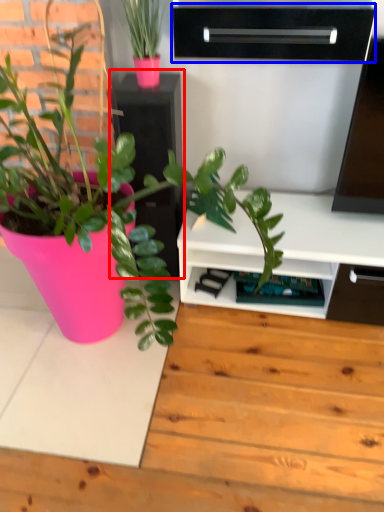
Question: Which point is further to the camera, file cabinet (highlighted by a red box) or shelf (highlighted by a blue box)?

Choices:
 (A) file cabinet
 (B) shelf

Answer: (A)